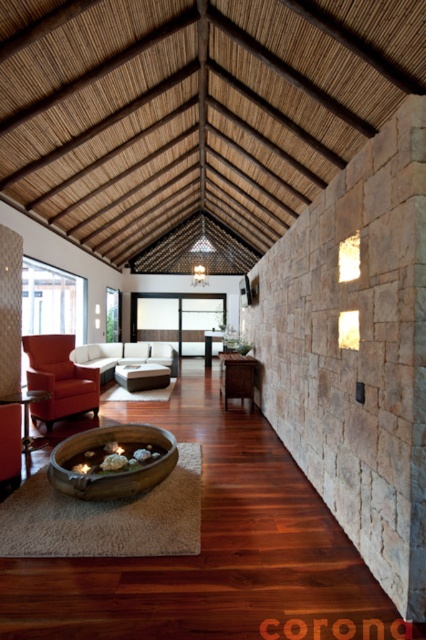
Question: Among these points, which one is farthest from the camera?

Choices:
 (A) (115, 436)
 (B) (146, 388)
 (C) (235, 384)
 (D) (210, 349)

Answer: (D)

Question: Does matte orange armchair at left have a lesser width compared to brown wood cabinet at center?

Choices:
 (A) yes
 (B) no

Answer: (B)

Question: Estimate the real-world distances between objects in this image. Which object is farther from the brown wood cabinet at center?

Choices:
 (A) matte wood coffee table at center
 (B) matte orange armchair at left
 (C) brown wooden fire pit at center

Answer: (A)

Question: Which is farther from the matte orange armchair at left?

Choices:
 (A) brown wooden fire pit at center
 (B) brown wood cabinet at center
 (C) matte wood coffee table at center

Answer: (C)

Question: Is matte orange armchair at left closer to the viewer compared to brown wood cabinet at center?

Choices:
 (A) yes
 (B) no

Answer: (A)

Question: Can you confirm if brown wooden fire pit at center is positioned to the right of matte wood coffee table at center?

Choices:
 (A) yes
 (B) no

Answer: (B)